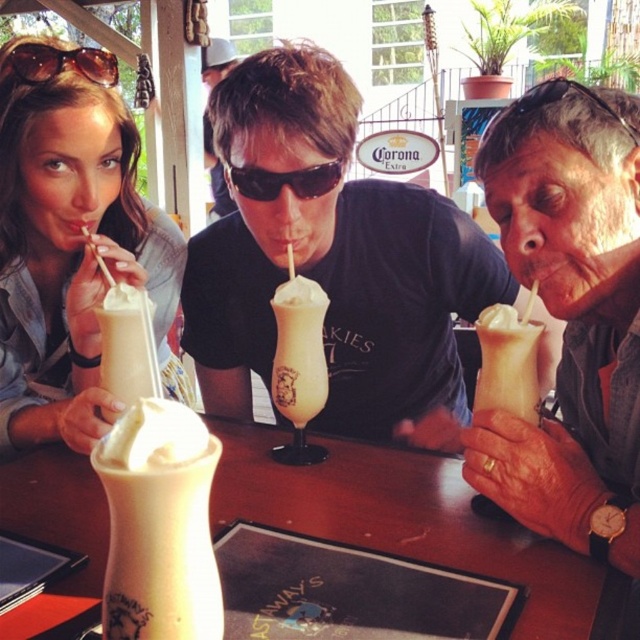
Can you confirm if matte black shirt at center is shorter than whipped cream topped glass at right?

No.

Is matte black shirt at center above whipped cream topped glass at right?

Indeed, matte black shirt at center is positioned over whipped cream topped glass at right.

Identify the location of matte black shirt at center. (333, 262).

Can you confirm if matte plastic cup at center is positioned to the right of brown matte sunglasses at upper left?

Yes, matte plastic cup at center is to the right of brown matte sunglasses at upper left.

Who is more forward, (584, 376) or (19, 49)?

Point (584, 376) is more forward.

Measure the distance between matte plastic cup at center and camera.

57.54 centimeters

You are a GUI agent. You are given a task and a screenshot of the screen. Output one action in this format:
    pyautogui.click(x=<x>, y=<y>)
    Task: Click on the matte plastic cup at center
    The height and width of the screenshot is (640, 640).
    Given the screenshot: What is the action you would take?
    pyautogui.click(x=572, y=323)

Who is lower down, matte plastic cup at center or white frosted glass at center?

white frosted glass at center is lower down.

Between point (529, 154) and point (460, 548), which one is positioned in front?

Point (460, 548) is in front.

The height and width of the screenshot is (640, 640). Identify the location of matte plastic cup at center. (572, 323).